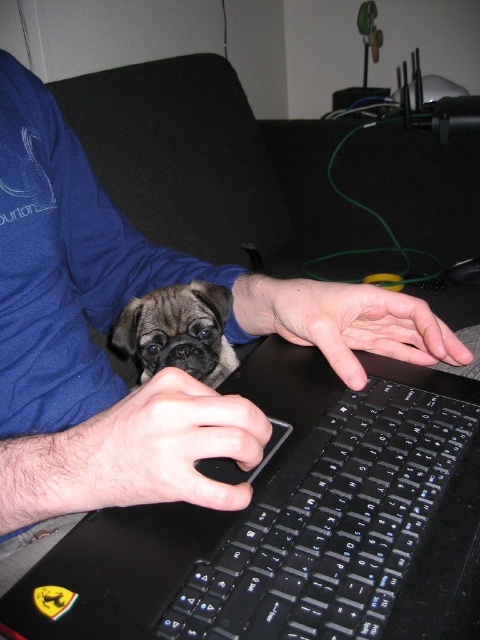
Who is taller, black plastic keyboard at lower center or fuzzy brown dog at center?

fuzzy brown dog at center

Does black plastic keyboard at lower center appear on the left side of fuzzy brown dog at center?

Incorrect, black plastic keyboard at lower center is not on the left side of fuzzy brown dog at center.

Is point (358, 408) closer to camera compared to point (157, 310)?

Yes, it is in front of point (157, 310).

At what (x,y) coordinates should I click in order to perform the action: click on black plastic keyboard at lower center. Please return your answer as a coordinate pair (x, y). The height and width of the screenshot is (640, 480). Looking at the image, I should click on (346, 528).

In the scene shown: Between black matte mouse at center and fuzzy brown dog at center, which one is positioned higher?

fuzzy brown dog at center is above.

Between black matte mouse at center and fuzzy brown dog at center, which one appears on the right side from the viewer's perspective?

black matte mouse at center

Is point (192, 422) less distant than point (168, 349)?

Yes, point (192, 422) is closer to viewer.

Where is `black matte mouse at center`? black matte mouse at center is located at coordinates (169, 445).

Does point (272, 552) come farther from viewer compared to point (200, 502)?

Yes, point (272, 552) is farther from viewer.

Between point (402, 621) and point (110, 420), which one is positioned behind?

The point (110, 420) is behind.

Locate an element on the screen. black plastic keyboard at lower center is located at coordinates (346, 528).